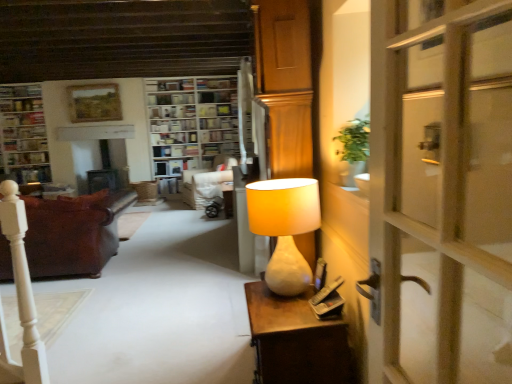
Identify the location of free spot above white marble desk at right (from a real-world perspective). (293, 302).